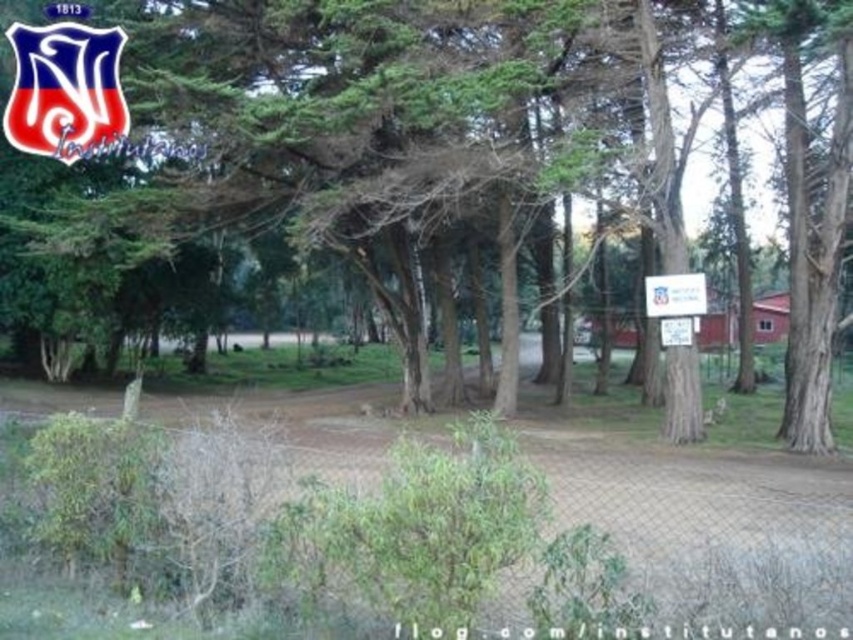
Which is more to the left, matte plastic logo at upper left or white plastic sign at center?

Positioned to the left is matte plastic logo at upper left.

Between point (15, 33) and point (662, 296), which one is positioned in front?

Point (15, 33) is in front.

Where is `matte plastic logo at upper left`? This screenshot has height=640, width=853. matte plastic logo at upper left is located at coordinates (65, 90).

Which is below, green textured tree at center or matte plastic logo at upper left?

green textured tree at center is below.

Measure the distance from green textured tree at center to matte plastic logo at upper left.

green textured tree at center and matte plastic logo at upper left are 20.83 feet apart from each other.

The height and width of the screenshot is (640, 853). Identify the location of green textured tree at center. (376, 120).

Does green textured tree at center appear on the left side of white plastic sign at center?

Indeed, green textured tree at center is positioned on the left side of white plastic sign at center.

Which is behind, point (36, 230) or point (676, 314)?

Positioned behind is point (36, 230).

Locate an element on the screen. green textured tree at center is located at coordinates (376, 120).